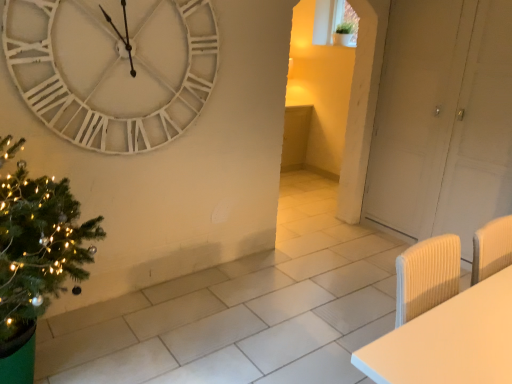
Image resolution: width=512 pixels, height=384 pixels. Describe the element at coordinates (443, 120) in the screenshot. I see `white matte door at right` at that location.

In order to face white ribbed chair at lower right, should I rotate leftwards or rightwards?

Rotate your view right by about 25.632°.

The height and width of the screenshot is (384, 512). Identify the location of white matte door at right. (443, 120).

Is green textured christmas tree at left placed right next to white matte door at right?

No, green textured christmas tree at left is not next to white matte door at right.

Considering the relative sizes of green textured christmas tree at left and white matte door at right in the image provided, is green textured christmas tree at left wider than white matte door at right?

Yes, green textured christmas tree at left is wider than white matte door at right.

Is green textured christmas tree at left positioned with its back to white matte door at right?

That's not correct — green textured christmas tree at left is not looking away from white matte door at right.

Is green textured christmas tree at left closer to camera compared to white matte door at right?

Yes, it is in front of white matte door at right.

Does point (400, 69) come closer to viewer compared to point (68, 60)?

No, it is behind (68, 60).

Locate an element on the screen. This screenshot has height=384, width=512. wall clock located above the white matte door at right (from the image's perspective) is located at coordinates (113, 68).

From a real-world perspective, is white matte door at right positioned above or below white wooden clock at upper left?

Clearly, from a real-world perspective, white matte door at right is below white wooden clock at upper left.

In the scene shown: Is white matte door at right far from white wooden clock at upper left?

That's right, there is a large distance between white matte door at right and white wooden clock at upper left.

Does point (90, 38) come behind point (45, 308)?

Yes, point (90, 38) is farther from viewer.

Is white wooden clock at upper left surrounding green textured christmas tree at left?

No, green textured christmas tree at left is located outside of white wooden clock at upper left.

I want to click on wall clock located above the green textured christmas tree at left (from the image's perspective), so click(113, 68).

From a real-world perspective, is white wooden clock at upper left positioned under green textured christmas tree at left based on gravity?

Incorrect, from a real-world perspective, white wooden clock at upper left is higher than green textured christmas tree at left.

In terms of width, does green textured christmas tree at left look wider or thinner when compared to white wooden clock at upper left?

green textured christmas tree at left is wider than white wooden clock at upper left.

At what (x,y) coordinates should I click in order to perform the action: click on christmas tree that appears on the left of white wooden clock at upper left. Please return your answer as a coordinate pair (x, y). Looking at the image, I should click on (36, 260).

Is green textured christmas tree at left positioned in front of white wooden clock at upper left?

Yes, the depth of green textured christmas tree at left is less than that of white wooden clock at upper left.

Looking at the image, does green textured christmas tree at left seem bigger or smaller compared to white wooden clock at upper left?

Considering their sizes, green textured christmas tree at left takes up more space than white wooden clock at upper left.

From a real-world perspective, is white ribbed chair at lower right physically located above or below white wooden clock at upper left?

white ribbed chair at lower right is below white wooden clock at upper left.

From the picture: Between white ribbed chair at lower right and white wooden clock at upper left, which one appears on the left side from the viewer's perspective?

Positioned to the left is white wooden clock at upper left.

Is white ribbed chair at lower right directly adjacent to white wooden clock at upper left?

They are not placed beside each other.

Considering the sizes of objects white ribbed chair at lower right and white wooden clock at upper left in the image provided, who is smaller, white ribbed chair at lower right or white wooden clock at upper left?

white wooden clock at upper left.

Which of these two, white matte door at right or green textured christmas tree at left, stands shorter?

green textured christmas tree at left is shorter.

Is white matte door at right bigger than green textured christmas tree at left?

Yes, white matte door at right is bigger than green textured christmas tree at left.

Is point (483, 54) positioned behind point (77, 235)?

Yes, it is behind point (77, 235).

The width and height of the screenshot is (512, 384). I want to click on door that appears behind the green textured christmas tree at left, so click(x=443, y=120).

Which object is positioned more to the left, white ribbed chair at lower right or white matte door at right?

white ribbed chair at lower right is more to the left.

What's the angular difference between white ribbed chair at lower right and white matte door at right's facing directions?

90.4 degrees.

Considering the sizes of objects white ribbed chair at lower right and white matte door at right in the image provided, who is thinner, white ribbed chair at lower right or white matte door at right?

Thinner between the two is white ribbed chair at lower right.

Does white ribbed chair at lower right have a smaller size compared to white matte door at right?

Yes, white ribbed chair at lower right is smaller than white matte door at right.

The image size is (512, 384). Find the location of `door above the green textured christmas tree at left (from the image's perspective)`. door above the green textured christmas tree at left (from the image's perspective) is located at coordinates (443, 120).

You are a GUI agent. You are given a task and a screenshot of the screen. Output one action in this format:
    pyautogui.click(x=<x>, y=<y>)
    Task: Click on the door located on the right of white wooden clock at upper left
    The width and height of the screenshot is (512, 384).
    Given the screenshot: What is the action you would take?
    [x=443, y=120]

Estimate the real-world distances between objects in this image. Which object is further from white ribbed chair at lower right, white matte door at right or green textured christmas tree at left?

white matte door at right lies further to white ribbed chair at lower right than the other object.

Considering their positions, is green textured christmas tree at left positioned closer to white ribbed chair at lower right than white wooden clock at upper left?

green textured christmas tree at left.

When comparing their distances from white matte door at right, does green textured christmas tree at left or white ribbed chair at lower right seem closer?

white ribbed chair at lower right is positioned closer to the anchor white matte door at right.

Looking at the image, which one is located further to green textured christmas tree at left, white wooden clock at upper left or white matte door at right?

white matte door at right is positioned further to the anchor green textured christmas tree at left.

Based on their spatial positions, is white wooden clock at upper left or white ribbed chair at lower right further from white matte door at right?

white ribbed chair at lower right is positioned further to the anchor white matte door at right.

Considering their positions, is green textured christmas tree at left positioned closer to white wooden clock at upper left than white matte door at right?

The object closer to white wooden clock at upper left is green textured christmas tree at left.

Looking at the image, which one is located further to white matte door at right, white ribbed chair at lower right or white wooden clock at upper left?

Among the two, white ribbed chair at lower right is located further to white matte door at right.

Looking at the image, which one is located closer to green textured christmas tree at left, white ribbed chair at lower right or white wooden clock at upper left?

white wooden clock at upper left.

The width and height of the screenshot is (512, 384). In order to click on wall clock located between green textured christmas tree at left and white ribbed chair at lower right in the left-right direction in this screenshot , I will do `click(113, 68)`.

Where is `wall clock between green textured christmas tree at left and white matte door at right in the horizontal direction`? This screenshot has height=384, width=512. wall clock between green textured christmas tree at left and white matte door at right in the horizontal direction is located at coordinates (113, 68).

Where is `furniture between white wooden clock at upper left and white matte door at right from left to right`? The height and width of the screenshot is (384, 512). furniture between white wooden clock at upper left and white matte door at right from left to right is located at coordinates (449, 340).

Image resolution: width=512 pixels, height=384 pixels. In order to click on furniture between green textured christmas tree at left and white matte door at right from left to right in this screenshot , I will do `click(449, 340)`.